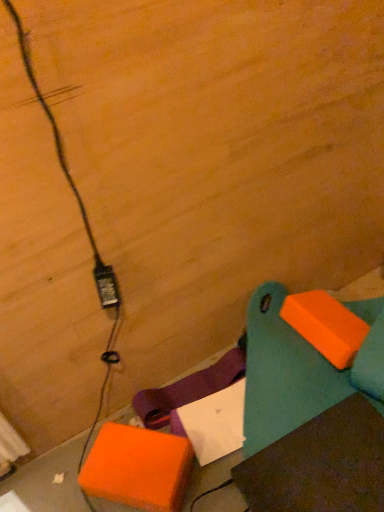
Question: Can you confirm if orange matte cardboard box at lower left is thinner than teal plastic bench at lower right?

Choices:
 (A) yes
 (B) no

Answer: (A)

Question: Is orange matte cardboard box at lower left positioned in front of teal plastic bench at lower right?

Choices:
 (A) no
 (B) yes

Answer: (A)

Question: Is orange matte cardboard box at lower left at the right side of teal plastic bench at lower right?

Choices:
 (A) yes
 (B) no

Answer: (B)

Question: From the image's perspective, would you say orange matte cardboard box at lower left is positioned over teal plastic bench at lower right?

Choices:
 (A) yes
 (B) no

Answer: (B)

Question: Would you say orange matte cardboard box at lower left is outside teal plastic bench at lower right?

Choices:
 (A) no
 (B) yes

Answer: (B)

Question: Could you tell me if orange matte cardboard box at lower left is facing teal plastic bench at lower right?

Choices:
 (A) yes
 (B) no

Answer: (B)

Question: Is teal plastic bench at lower right behind black plastic power plug at lower left?

Choices:
 (A) no
 (B) yes

Answer: (A)

Question: Does teal plastic bench at lower right have a greater height compared to black plastic power plug at lower left?

Choices:
 (A) no
 (B) yes

Answer: (B)

Question: Is teal plastic bench at lower right next to black plastic power plug at lower left?

Choices:
 (A) no
 (B) yes

Answer: (A)

Question: Is teal plastic bench at lower right oriented towards black plastic power plug at lower left?

Choices:
 (A) no
 (B) yes

Answer: (A)

Question: Is black plastic power plug at lower left inside teal plastic bench at lower right?

Choices:
 (A) yes
 (B) no

Answer: (B)

Question: Considering the relative sizes of teal plastic bench at lower right and black plastic power plug at lower left in the image provided, is teal plastic bench at lower right wider than black plastic power plug at lower left?

Choices:
 (A) yes
 (B) no

Answer: (A)

Question: From the image's perspective, is black plastic power plug at lower left above orange matte cardboard box at lower left?

Choices:
 (A) yes
 (B) no

Answer: (A)